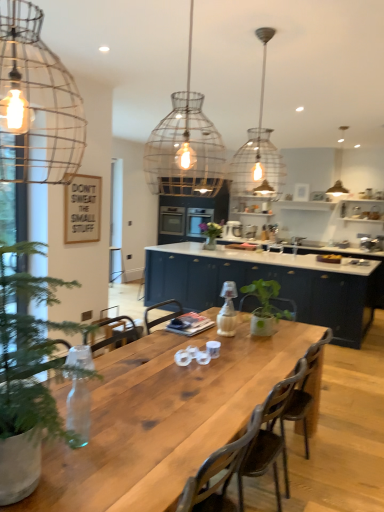
Question: Would you consider wire mesh pendant light at upper left, marked as the 3th lamp in a back-to-front arrangement, to be distant from matte glass pendant light at upper right, which is the third lamp in left-to-right order?

Choices:
 (A) yes
 (B) no

Answer: (A)

Question: Is wire mesh pendant light at upper left, placed as the first lamp when sorted from left to right, wider than matte glass pendant light at upper right, the first lamp positioned from the right?

Choices:
 (A) yes
 (B) no

Answer: (A)

Question: From the image's perspective, is wire mesh pendant light at upper left, which is the first lamp in front-to-back order, beneath matte glass pendant light at upper right, marked as the third lamp in a front-to-back arrangement?

Choices:
 (A) no
 (B) yes

Answer: (B)

Question: Does wire mesh pendant light at upper left, which is the first lamp in front-to-back order, appear on the right side of matte glass pendant light at upper right, marked as the third lamp in a front-to-back arrangement?

Choices:
 (A) no
 (B) yes

Answer: (A)

Question: Would you say wire mesh pendant light at upper left, placed as the first lamp when sorted from left to right, contains matte glass pendant light at upper right, which appears as the 1th lamp when viewed from the back?

Choices:
 (A) yes
 (B) no

Answer: (B)

Question: From a real-world perspective, is wire mesh pendant light at upper left, which is the 3th lamp in right-to-left order, under matte glass pendant light at upper right, which appears as the 1th lamp when viewed from the back?

Choices:
 (A) yes
 (B) no

Answer: (A)

Question: From a real-world perspective, is green matte vase at center located beneath matte glass pendant light at upper right, marked as the third lamp in a front-to-back arrangement?

Choices:
 (A) no
 (B) yes

Answer: (B)

Question: Is green matte vase at center not inside matte glass pendant light at upper right, the first lamp positioned from the right?

Choices:
 (A) yes
 (B) no

Answer: (A)

Question: Would you consider green matte vase at center to be distant from matte glass pendant light at upper right, marked as the third lamp in a front-to-back arrangement?

Choices:
 (A) no
 (B) yes

Answer: (B)

Question: Considering the relative sizes of green matte vase at center and matte glass pendant light at upper right, the first lamp positioned from the right, in the image provided, is green matte vase at center bigger than matte glass pendant light at upper right, the first lamp positioned from the right,?

Choices:
 (A) yes
 (B) no

Answer: (B)

Question: Is green matte vase at center wider than matte glass pendant light at upper right, which appears as the 1th lamp when viewed from the back?

Choices:
 (A) yes
 (B) no

Answer: (A)

Question: Does green matte vase at center have a lesser height compared to matte glass pendant light at upper right, which is the third lamp in left-to-right order?

Choices:
 (A) no
 (B) yes

Answer: (B)

Question: Can you confirm if green matte vase at center is taller than wire mesh pendant light at upper left, which is the 3th lamp in right-to-left order?

Choices:
 (A) yes
 (B) no

Answer: (B)